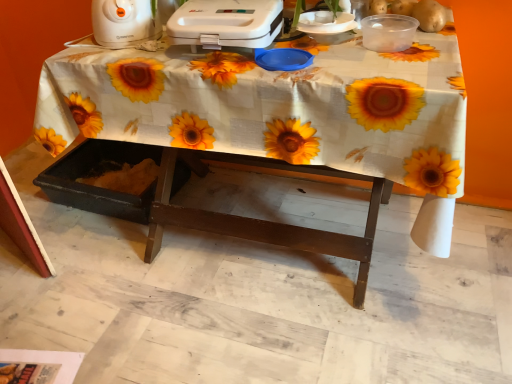
The image size is (512, 384). In order to click on free space below white plastic toaster at upper center, the 1th appliance in the right-to-left sequence (from a real-world perspective) in this screenshot , I will do `click(221, 54)`.